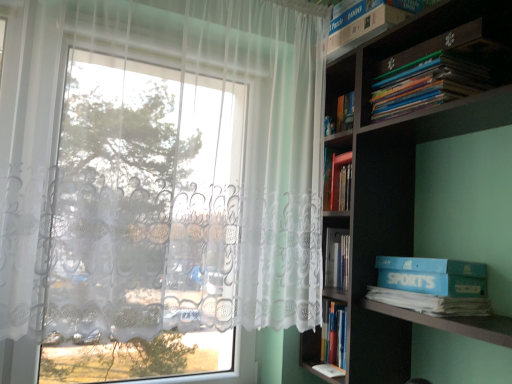
In order to face white cardboard box at upper right, which appears as the 2th book when ordered from the bottom, should I rotate leftwards or rightwards?

Rotate right and turn 15.791 degrees.

The width and height of the screenshot is (512, 384). Describe the element at coordinates (404, 158) in the screenshot. I see `dark wood bookcase at right` at that location.

What is the approximate height of hardcover books at center, the 2th book viewed from the top?

The height of hardcover books at center, the 2th book viewed from the top, is 9.26 inches.

In order to face hardcover books at center, the 2th book viewed from the top, should I rotate leftwards or rightwards?

To face it directly, rotate right by 12.082 degrees.

This screenshot has width=512, height=384. What do you see at coordinates (156, 182) in the screenshot?
I see `white lace curtain at left` at bounding box center [156, 182].

The height and width of the screenshot is (384, 512). What are the coordinates of `white cardboard box at upper right, which is counted as the 1th book, starting from the top` in the screenshot? It's located at (370, 19).

Based on the photo, from their relative heights in the image, would you say white cardboard box at upper right, which is counted as the 1th book, starting from the top, is taller or shorter than dark wood bookcase at right?

white cardboard box at upper right, which is counted as the 1th book, starting from the top, is shorter than dark wood bookcase at right.

Considering the positions of point (374, 6) and point (399, 235), is point (374, 6) closer or farther from the camera than point (399, 235)?

Clearly, point (374, 6) is closer to the camera than point (399, 235).

Is white cardboard box at upper right, which is counted as the 1th book, starting from the top, at the left side of dark wood bookcase at right?

Correct, you'll find white cardboard box at upper right, which is counted as the 1th book, starting from the top, to the left of dark wood bookcase at right.

From the image's perspective, which object appears higher, white lace curtain at left or wooden bookshelf at upper right?

wooden bookshelf at upper right, from the image's perspective.

Considering the sizes of objects white lace curtain at left and wooden bookshelf at upper right in the image provided, who is smaller, white lace curtain at left or wooden bookshelf at upper right?

wooden bookshelf at upper right.

Considering the sizes of white lace curtain at left and wooden bookshelf at upper right in the image, is white lace curtain at left taller or shorter than wooden bookshelf at upper right?

white lace curtain at left is taller than wooden bookshelf at upper right.

Is white lace curtain at left further to camera compared to wooden bookshelf at upper right?

No, white lace curtain at left is in front of wooden bookshelf at upper right.

Which object is thinner, blue cardboard box at right or white cardboard box at upper right, which is counted as the 1th book, starting from the top?

Thinner between the two is blue cardboard box at right.

Looking at this image, does blue cardboard box at right contain white cardboard box at upper right, which is counted as the 1th book, starting from the top?

That's incorrect, white cardboard box at upper right, which is counted as the 1th book, starting from the top, is not inside blue cardboard box at right.

Locate an element on the screen. This screenshot has height=384, width=512. book that is above the blue cardboard box at right (from a real-world perspective) is located at coordinates (370, 19).

Visually, is blue cardboard box at right positioned to the left or to the right of white cardboard box at upper right, which is counted as the 1th book, starting from the top?

Based on their positions, blue cardboard box at right is located to the right of white cardboard box at upper right, which is counted as the 1th book, starting from the top.

Considering the relative sizes of hardcover books at center, the 2th book viewed from the top, and white lace curtain at left in the image provided, is hardcover books at center, the 2th book viewed from the top, wider than white lace curtain at left?

No, hardcover books at center, the 2th book viewed from the top, is not wider than white lace curtain at left.

In the image, is hardcover books at center, the 2th book viewed from the top, positioned in front of or behind white lace curtain at left?

In the image, hardcover books at center, the 2th book viewed from the top, appears behind white lace curtain at left.

Considering the positions of objects hardcover books at center, the 2th book viewed from the top, and white lace curtain at left in the image provided, who is more to the left, hardcover books at center, the 2th book viewed from the top, or white lace curtain at left?

From the viewer's perspective, white lace curtain at left appears more on the left side.

Is dark wood bookcase at right oriented away from blue cardboard box at right?

Yes, dark wood bookcase at right is facing away from blue cardboard box at right.

Is blue cardboard box at right a part of dark wood bookcase at right?

Yes, dark wood bookcase at right is surrounding blue cardboard box at right.

Considering the points (485, 10) and (420, 258), which point is behind, point (485, 10) or point (420, 258)?

Point (420, 258)

Which object is further away from the camera, dark wood bookcase at right or blue cardboard box at right?

Positioned behind is blue cardboard box at right.

Considering the relative sizes of blue cardboard box at right and white lace curtain at left in the image provided, is blue cardboard box at right wider than white lace curtain at left?

Correct, the width of blue cardboard box at right exceeds that of white lace curtain at left.

Which point is more distant from viewer, (444, 294) or (284, 297)?

The point (284, 297) is farther from the camera.

Is blue cardboard box at right next to white lace curtain at left and touching it?

blue cardboard box at right is not next to white lace curtain at left, and they're not touching.

Which of these two, dark wood bookcase at right or wooden bookshelf at upper right, is bigger?

With larger size is dark wood bookcase at right.

Is dark wood bookcase at right not within wooden bookshelf at upper right?

That's correct, dark wood bookcase at right is outside of wooden bookshelf at upper right.

How far apart are dark wood bookcase at right and wooden bookshelf at upper right?

A distance of 16.48 centimeters exists between dark wood bookcase at right and wooden bookshelf at upper right.

How different are the orientations of dark wood bookcase at right and wooden bookshelf at upper right in degrees?

They differ by 0.703 degrees in their facing directions.

What are the coordinates of `bookcase below the white cardboard box at upper right, which is counted as the 1th book, starting from the top (from a real-world perspective)` in the screenshot? It's located at (404, 158).

This screenshot has height=384, width=512. What are the coordinates of `shelf behind the white lace curtain at left` in the screenshot? It's located at 426,47.

Which object lies further to the anchor point dark wood bookcase at right, white lace curtain at left or hardcover books at center, placed as the first book when sorted from bottom to top?

white lace curtain at left lies further to dark wood bookcase at right than the other object.

Which object lies further to the anchor point dark wood bookcase at right, hardcover books at center, the 2th book viewed from the top, or white lace curtain at left?

Based on the image, white lace curtain at left appears to be further to dark wood bookcase at right.

Which object lies further to the anchor point hardcover books at center, placed as the first book when sorted from bottom to top, blue cardboard box at right or white lace curtain at left?

white lace curtain at left lies further to hardcover books at center, placed as the first book when sorted from bottom to top, than the other object.

When comparing their distances from hardcover books at center, the 2th book viewed from the top, does wooden bookshelf at upper right or blue cardboard box at right seem further?

Based on the image, wooden bookshelf at upper right appears to be further to hardcover books at center, the 2th book viewed from the top.

When comparing their distances from dark wood bookcase at right, does white lace curtain at left or wooden bookshelf at upper right seem further?

white lace curtain at left.

From the image, which object appears to be farther from hardcover books at center, the 2th book viewed from the top, blue cardboard box at right or white cardboard box at upper right, which appears as the 2th book when ordered from the bottom?

white cardboard box at upper right, which appears as the 2th book when ordered from the bottom, lies further to hardcover books at center, the 2th book viewed from the top, than the other object.

Looking at the image, which one is located closer to white cardboard box at upper right, which appears as the 2th book when ordered from the bottom, blue cardboard box at right or hardcover books at center, placed as the first book when sorted from bottom to top?

Among the two, blue cardboard box at right is located nearer to white cardboard box at upper right, which appears as the 2th book when ordered from the bottom.

When comparing their distances from hardcover books at center, placed as the first book when sorted from bottom to top, does blue cardboard box at right or dark wood bookcase at right seem further?

Among the two, dark wood bookcase at right is located further to hardcover books at center, placed as the first book when sorted from bottom to top.

At what (x,y) coordinates should I click in order to perform the action: click on bookcase between white lace curtain at left and wooden bookshelf at upper right from left to right. Please return your answer as a coordinate pair (x, y). Looking at the image, I should click on (404, 158).

At what (x,y) coordinates should I click in order to perform the action: click on paperback book between dark wood bookcase at right and hardcover books at center, placed as the first book when sorted from bottom to top, in the front-back direction. Please return your answer as a coordinate pair (x, y). Looking at the image, I should click on (432, 276).

At what (x,y) coordinates should I click in order to perform the action: click on bookcase between white cardboard box at upper right, which appears as the 2th book when ordered from the bottom, and blue cardboard box at right, in the vertical direction. Please return your answer as a coordinate pair (x, y). The width and height of the screenshot is (512, 384). Looking at the image, I should click on (404, 158).

The image size is (512, 384). Find the location of `bookcase located between white lace curtain at left and blue cardboard box at right in the left-right direction`. bookcase located between white lace curtain at left and blue cardboard box at right in the left-right direction is located at coordinates (404, 158).